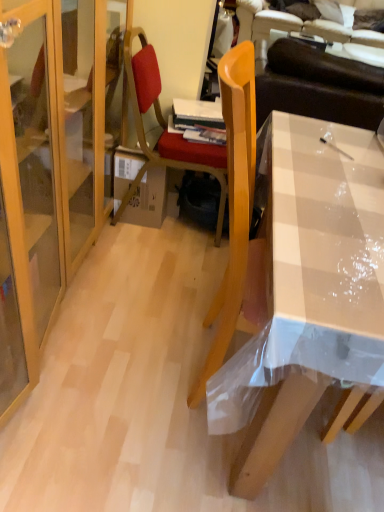
Question: Is cardboard box at center outside clear plastic desk at center?

Choices:
 (A) yes
 (B) no

Answer: (A)

Question: Can you confirm if cardboard box at center is positioned to the right of clear plastic desk at center?

Choices:
 (A) no
 (B) yes

Answer: (A)

Question: Is cardboard box at center positioned with its back to clear plastic desk at center?

Choices:
 (A) no
 (B) yes

Answer: (A)

Question: Does cardboard box at center have a greater width compared to clear plastic desk at center?

Choices:
 (A) no
 (B) yes

Answer: (A)

Question: Is clear plastic desk at center surrounded by cardboard box at center?

Choices:
 (A) yes
 (B) no

Answer: (B)

Question: From the image's perspective, is cardboard box at center located above or below brown leather couch at upper right?

Choices:
 (A) below
 (B) above

Answer: (A)

Question: Relative to brown leather couch at upper right, is cardboard box at center in front or behind?

Choices:
 (A) front
 (B) behind

Answer: (A)

Question: Would you say cardboard box at center is to the left or to the right of brown leather couch at upper right in the picture?

Choices:
 (A) right
 (B) left

Answer: (B)

Question: Looking at the image, does cardboard box at center seem bigger or smaller compared to brown leather couch at upper right?

Choices:
 (A) small
 (B) big

Answer: (A)

Question: Considering the relative positions of brown leather couch at upper right and cardboard box at center in the image provided, is brown leather couch at upper right to the left or to the right of cardboard box at center?

Choices:
 (A) left
 (B) right

Answer: (B)

Question: Does point click(314, 19) appear closer or farther from the camera than point click(132, 201)?

Choices:
 (A) farther
 (B) closer

Answer: (A)

Question: Based on their sizes in the image, would you say brown leather couch at upper right is bigger or smaller than cardboard box at center?

Choices:
 (A) big
 (B) small

Answer: (A)

Question: From the image's perspective, is brown leather couch at upper right positioned above or below cardboard box at center?

Choices:
 (A) above
 (B) below

Answer: (A)

Question: Does point (218, 181) appear closer or farther from the camera than point (125, 175)?

Choices:
 (A) farther
 (B) closer

Answer: (A)

Question: From their relative heights in the image, would you say wooden chair at center is taller or shorter than cardboard box at center?

Choices:
 (A) tall
 (B) short

Answer: (A)